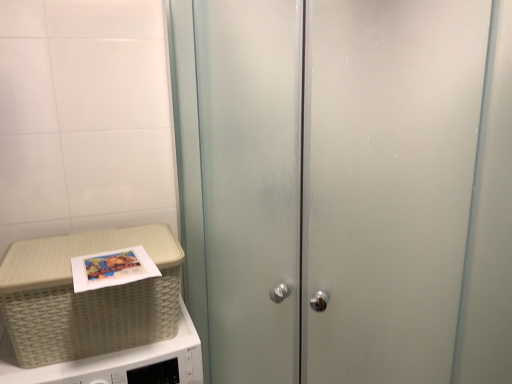
Question: From a real-world perspective, is beige woven picnic basket at lower left positioned under frosted glass cabinet at center based on gravity?

Choices:
 (A) no
 (B) yes

Answer: (B)

Question: From the image's perspective, is beige woven picnic basket at lower left below frosted glass cabinet at center?

Choices:
 (A) no
 (B) yes

Answer: (B)

Question: Does beige woven picnic basket at lower left have a greater height compared to frosted glass cabinet at center?

Choices:
 (A) no
 (B) yes

Answer: (A)

Question: Does beige woven picnic basket at lower left come behind frosted glass cabinet at center?

Choices:
 (A) no
 (B) yes

Answer: (B)

Question: Does beige woven picnic basket at lower left have a larger size compared to frosted glass cabinet at center?

Choices:
 (A) yes
 (B) no

Answer: (B)

Question: From a real-world perspective, is frosted glass cabinet at center physically located above or below white woven basket at left?

Choices:
 (A) above
 (B) below

Answer: (A)

Question: In the image, is frosted glass cabinet at center on the left side or the right side of white woven basket at left?

Choices:
 (A) right
 (B) left

Answer: (A)

Question: Considering the positions of frosted glass cabinet at center and white woven basket at left in the image, is frosted glass cabinet at center wider or thinner than white woven basket at left?

Choices:
 (A) thin
 (B) wide

Answer: (B)

Question: From the image's perspective, is frosted glass cabinet at center located above or below white woven basket at left?

Choices:
 (A) below
 (B) above

Answer: (B)

Question: Based on their positions, is frosted glass cabinet at center located to the left or right of beige woven picnic basket at lower left?

Choices:
 (A) right
 (B) left

Answer: (A)

Question: From the image's perspective, relative to beige woven picnic basket at lower left, is frosted glass cabinet at center above or below?

Choices:
 (A) below
 (B) above

Answer: (B)

Question: From their relative heights in the image, would you say frosted glass cabinet at center is taller or shorter than beige woven picnic basket at lower left?

Choices:
 (A) short
 (B) tall

Answer: (B)

Question: Is frosted glass cabinet at center inside the boundaries of beige woven picnic basket at lower left, or outside?

Choices:
 (A) outside
 (B) inside

Answer: (A)

Question: From their relative heights in the image, would you say white woven basket at left is taller or shorter than beige woven picnic basket at lower left?

Choices:
 (A) short
 (B) tall

Answer: (B)

Question: From the image's perspective, is white woven basket at left above or below beige woven picnic basket at lower left?

Choices:
 (A) below
 (B) above

Answer: (A)